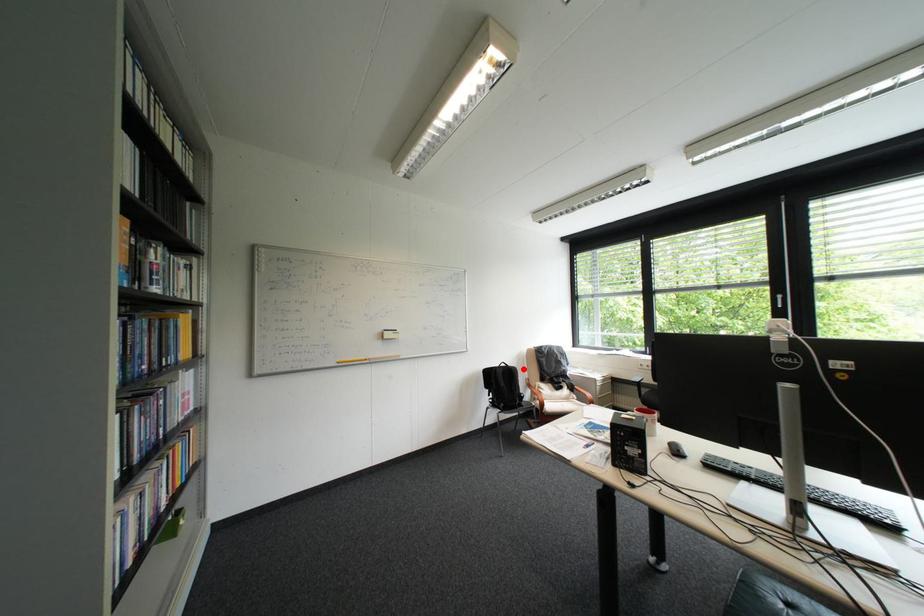
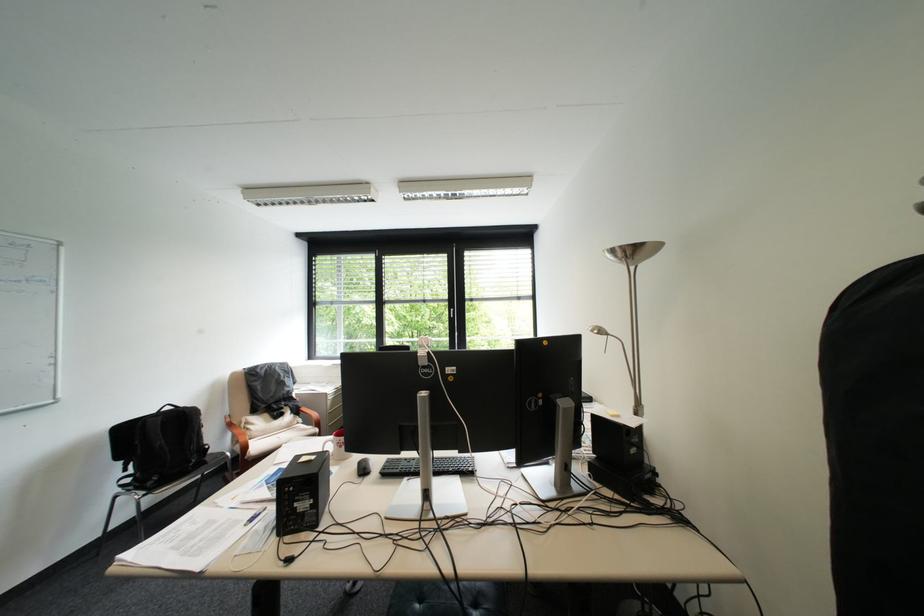
The point at the highlighted location is marked in the first image. Where is the corresponding point in the second image?

(198, 411)